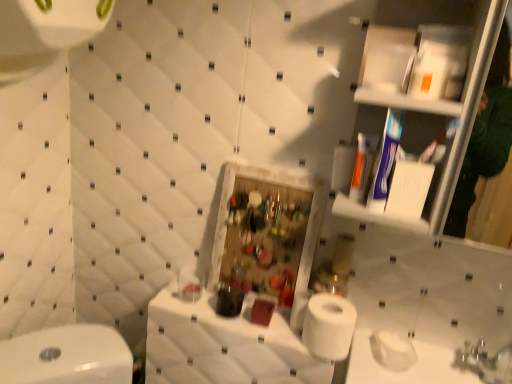
This screenshot has height=384, width=512. Describe the element at coordinates (392, 350) in the screenshot. I see `white matte toilet paper at lower right` at that location.

Locate an element on the screen. white matte toilet paper at lower right is located at coordinates (392, 350).

What is the approximate width of white matte toilet paper at lower right?

white matte toilet paper at lower right is 4.39 inches in width.

What do you see at coordinates (223, 346) in the screenshot?
I see `white fabric counter at center` at bounding box center [223, 346].

Identify the location of white fabric counter at center. The image size is (512, 384). pos(223,346).

Where is `white matte toilet paper at lower right`? The width and height of the screenshot is (512, 384). white matte toilet paper at lower right is located at coordinates (392, 350).

Which object is positioned more to the left, white matte toilet paper at lower right or white fabric counter at center?

Positioned to the left is white fabric counter at center.

Is white matte toilet paper at lower right in front of white fabric counter at center?

No, white matte toilet paper at lower right is behind white fabric counter at center.

Is point (393, 365) positioned in front of point (287, 330)?

Yes, it is.

From the image's perspective, which one is positioned higher, white matte toilet paper at lower right or white fabric counter at center?

white matte toilet paper at lower right.

From a real-world perspective, is white matte toilet paper at lower right above or below white fabric counter at center?

In terms of real-world spatial position, white matte toilet paper at lower right is above white fabric counter at center.

Considering the sizes of objects white matte toilet paper at lower right and white fabric counter at center in the image provided, who is thinner, white matte toilet paper at lower right or white fabric counter at center?

white matte toilet paper at lower right.

Does white matte toilet paper at lower right have a lesser height compared to white fabric counter at center?

Correct, white matte toilet paper at lower right is not as tall as white fabric counter at center.

Considering the relative sizes of white matte toilet paper at lower right and white fabric counter at center in the image provided, is white matte toilet paper at lower right bigger than white fabric counter at center?

Incorrect, white matte toilet paper at lower right is not larger than white fabric counter at center.

Looking at this image, is white matte toilet paper at lower right not within white fabric counter at center?

Absolutely, white matte toilet paper at lower right is external to white fabric counter at center.

Is white matte toilet paper at lower right beside white fabric counter at center?

white matte toilet paper at lower right and white fabric counter at center are clearly separated.

From the picture: Is white matte toilet paper at lower right facing away from white fabric counter at center?

No, white matte toilet paper at lower right is not facing away from white fabric counter at center.

How distant is white matte toilet paper at lower right from white fabric counter at center?

white matte toilet paper at lower right and white fabric counter at center are 14.15 inches apart.

Image resolution: width=512 pixels, height=384 pixels. I want to click on toilet paper above the white fabric counter at center (from a real-world perspective), so click(x=392, y=350).

Does white fabric counter at center appear on the left side of white matte toilet paper at lower right?

Correct, you'll find white fabric counter at center to the left of white matte toilet paper at lower right.

Based on the photo, in the image, is white fabric counter at center positioned in front of or behind white matte toilet paper at lower right?

In the image, white fabric counter at center appears in front of white matte toilet paper at lower right.

Considering the positions of points (152, 320) and (395, 340), is point (152, 320) farther from camera compared to point (395, 340)?

Yes, it is behind point (395, 340).

From the image's perspective, is white fabric counter at center located above or below white matte toilet paper at lower right?

From the image's perspective, white fabric counter at center appears below white matte toilet paper at lower right.

From a real-world perspective, does white fabric counter at center stand above white matte toilet paper at lower right?

No, from a real-world perspective, white fabric counter at center is not above white matte toilet paper at lower right.

Is white fabric counter at center wider or thinner than white matte toilet paper at lower right?

Clearly, white fabric counter at center has more width compared to white matte toilet paper at lower right.

Which of these two, white fabric counter at center or white matte toilet paper at lower right, stands taller?

Standing taller between the two is white fabric counter at center.

Does white fabric counter at center have a larger size compared to white matte toilet paper at lower right?

Correct, white fabric counter at center is larger in size than white matte toilet paper at lower right.

Is white fabric counter at center completely or partially outside of white matte toilet paper at lower right?

white fabric counter at center lies outside white matte toilet paper at lower right's area.

Is the surface of white fabric counter at center in direct contact with white matte toilet paper at lower right?

No, white fabric counter at center is not making contact with white matte toilet paper at lower right.

Is white fabric counter at center oriented towards white matte toilet paper at lower right?

No, white fabric counter at center is not turned towards white matte toilet paper at lower right.

What's the angular difference between white fabric counter at center and white matte toilet paper at lower right's facing directions?

The facing directions of white fabric counter at center and white matte toilet paper at lower right are 0.291 degrees apart.

I want to click on toilet paper that appears behind the white fabric counter at center, so click(392, 350).

Where is `counter top in front of the white matte toilet paper at lower right`? counter top in front of the white matte toilet paper at lower right is located at coordinates (223, 346).

Locate an element on the screen. Image resolution: width=512 pixels, height=384 pixels. toilet paper behind the white fabric counter at center is located at coordinates (392, 350).